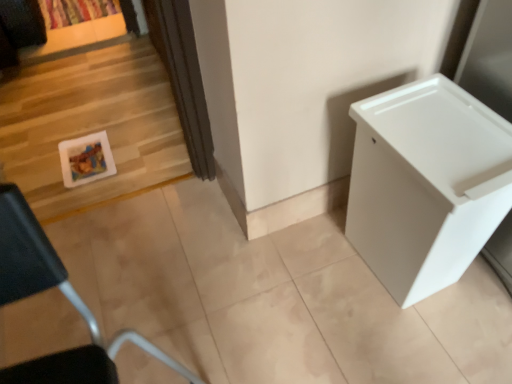
Find the location of a particular element. The width and height of the screenshot is (512, 384). vacant area situated to the left side of white plastic changing table at right is located at coordinates (312, 277).